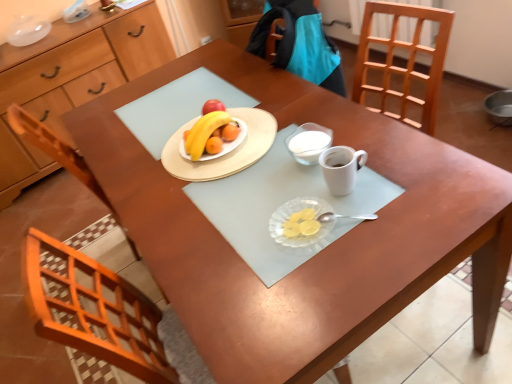
This screenshot has width=512, height=384. In order to click on vacant area that lies between white matte coffee cup at center and matte wooden plate at center in this screenshot , I will do `click(272, 180)`.